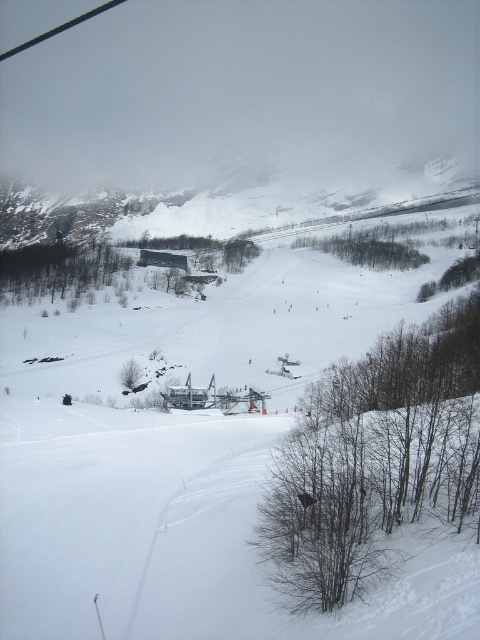
From the picture: Which is more to the right, white powdery snow at center or brown textured tree at center?

From the viewer's perspective, brown textured tree at center appears more on the right side.

Between point (260, 371) and point (398, 241), which one is positioned behind?

Point (398, 241)

Where is `white powdery snow at center`? white powdery snow at center is located at coordinates (187, 460).

Who is taller, white powdery snow at center or green matte tree at lower left?

white powdery snow at center

Between white powdery snow at center and green matte tree at lower left, which one appears on the right side from the viewer's perspective?

white powdery snow at center is more to the right.

Who is more distant from viewer, (139, 412) or (139, 380)?

The point (139, 380) is behind.

Locate an element on the screen. white powdery snow at center is located at coordinates (187, 460).

Which is more to the right, brown textured tree at center or green matte tree at lower left?

brown textured tree at center

Is brown textured tree at center positioned behind green matte tree at lower left?

Answer: Yes.

Is point (420, 253) positioned behind point (137, 365)?

Yes, it is behind point (137, 365).

Find the location of a particular element. The image size is (480, 640). brown textured tree at center is located at coordinates (368, 248).